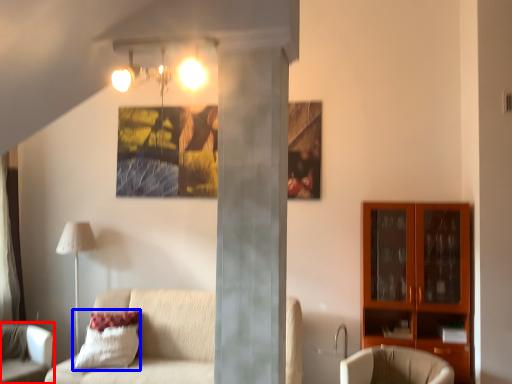
Question: Which of the following is the farthest to the observer, chair (highlighted by a red box) or pillow (highlighted by a blue box)?

Choices:
 (A) chair
 (B) pillow

Answer: (B)